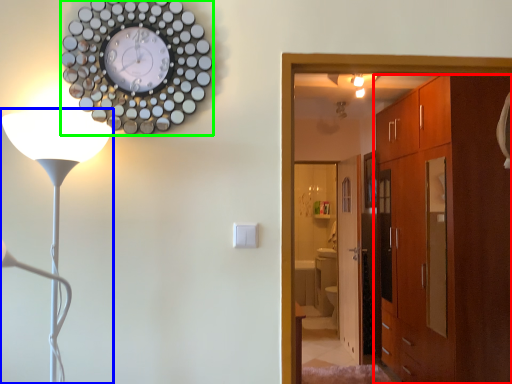
Question: Which object is positioned farthest from cabinetry (highlighted by a red box)? Select from lamp (highlighted by a blue box) and wall clock (highlighted by a green box).

Choices:
 (A) lamp
 (B) wall clock

Answer: (A)